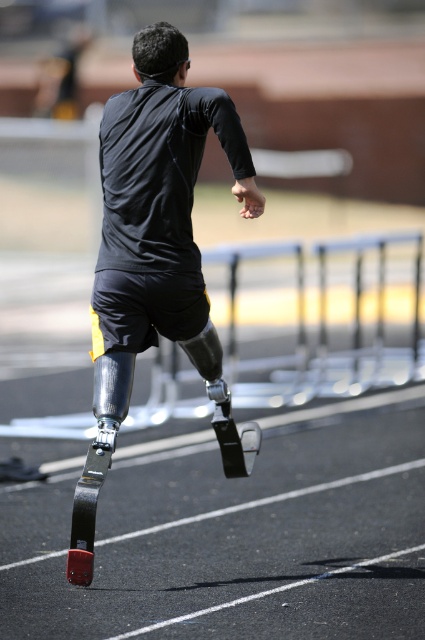
You are a photographer positioned at the starting line of the race. You want to take a photo of the matte black prosthetic leg at center and the black rubber race track at lower left. Based on their positions, which object should be placed on the right side of the photo to align with the scene?

The black rubber race track at lower left should be placed on the right side of the photo because according to the description, it is positioned on the right side of the matte black prosthetic leg at center.